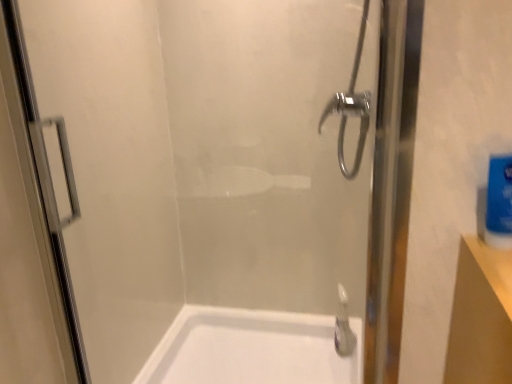
Describe the element at coordinates (251, 349) in the screenshot. I see `white glossy bathtub at lower center` at that location.

Measure the distance between point (295, 354) and camera.

1.82 meters.

The image size is (512, 384). Identify the location of white glossy bathtub at lower center. (251, 349).

This screenshot has height=384, width=512. I want to click on white glossy bathtub at lower center, so click(251, 349).